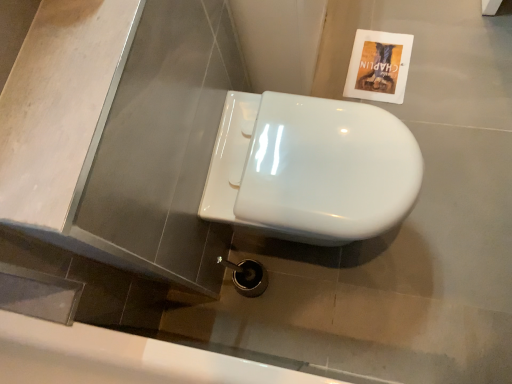
Question: Can you see white glossy toilet at center touching matte paper flyer at upper right?

Choices:
 (A) no
 (B) yes

Answer: (A)

Question: Is white glossy toilet at center at the right side of matte paper flyer at upper right?

Choices:
 (A) no
 (B) yes

Answer: (A)

Question: From a real-world perspective, is white glossy toilet at center under matte paper flyer at upper right?

Choices:
 (A) no
 (B) yes

Answer: (A)

Question: Is white glossy toilet at center oriented towards matte paper flyer at upper right?

Choices:
 (A) yes
 (B) no

Answer: (B)

Question: From a real-world perspective, is white glossy toilet at center over matte paper flyer at upper right?

Choices:
 (A) no
 (B) yes

Answer: (B)

Question: Is white glossy bath at lower center inside the boundaries of matte paper flyer at upper right, or outside?

Choices:
 (A) outside
 (B) inside

Answer: (A)

Question: From their relative heights in the image, would you say white glossy bath at lower center is taller or shorter than matte paper flyer at upper right?

Choices:
 (A) tall
 (B) short

Answer: (A)

Question: Is point (247, 374) closer or farther from the camera than point (370, 56)?

Choices:
 (A) farther
 (B) closer

Answer: (B)

Question: Is white glossy bath at lower center to the left or to the right of matte paper flyer at upper right in the image?

Choices:
 (A) right
 (B) left

Answer: (B)

Question: Considering the positions of white glossy bath at lower center and white glossy toilet at center in the image, is white glossy bath at lower center wider or thinner than white glossy toilet at center?

Choices:
 (A) thin
 (B) wide

Answer: (B)

Question: From the image's perspective, relative to white glossy toilet at center, is white glossy bath at lower center above or below?

Choices:
 (A) below
 (B) above

Answer: (A)

Question: Is white glossy bath at lower center taller or shorter than white glossy toilet at center?

Choices:
 (A) short
 (B) tall

Answer: (B)

Question: Considering their positions, is white glossy bath at lower center located in front of or behind white glossy toilet at center?

Choices:
 (A) front
 (B) behind

Answer: (A)

Question: Would you say white glossy toilet at center is inside or outside matte paper flyer at upper right?

Choices:
 (A) inside
 (B) outside

Answer: (B)

Question: In the image, is white glossy toilet at center positioned in front of or behind matte paper flyer at upper right?

Choices:
 (A) behind
 (B) front

Answer: (B)